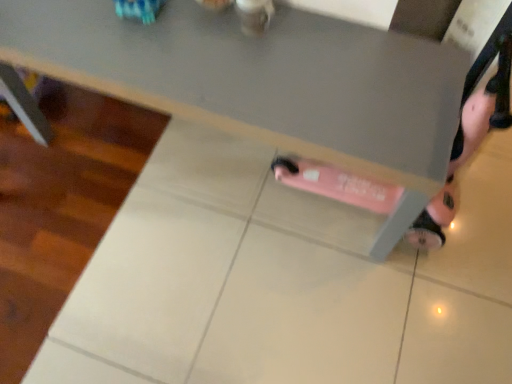
Locate an element on the screen. The width and height of the screenshot is (512, 384). matte gray table at center is located at coordinates (266, 83).

Describe the element at coordinates (266, 83) in the screenshot. I see `matte gray table at center` at that location.

Where is `matte gray table at center`? Image resolution: width=512 pixels, height=384 pixels. matte gray table at center is located at coordinates (266, 83).